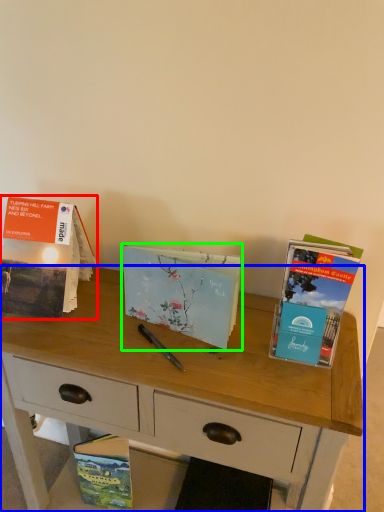
Question: Which object is positioned farthest from book (highlighted by a red box)? Select from desk (highlighted by a blue box) and book (highlighted by a green box).

Choices:
 (A) desk
 (B) book

Answer: (A)